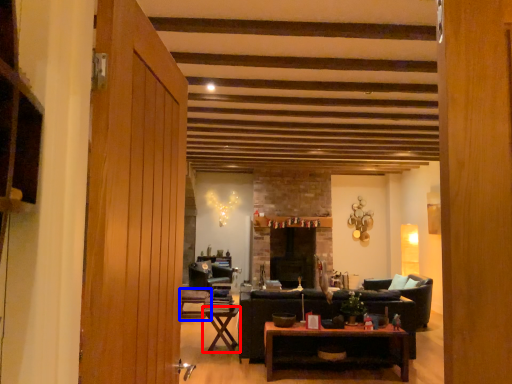
Question: Which object is closer to the camera taking this photo, table (highlighted by a red box) or chair (highlighted by a blue box)?

Choices:
 (A) table
 (B) chair

Answer: (A)